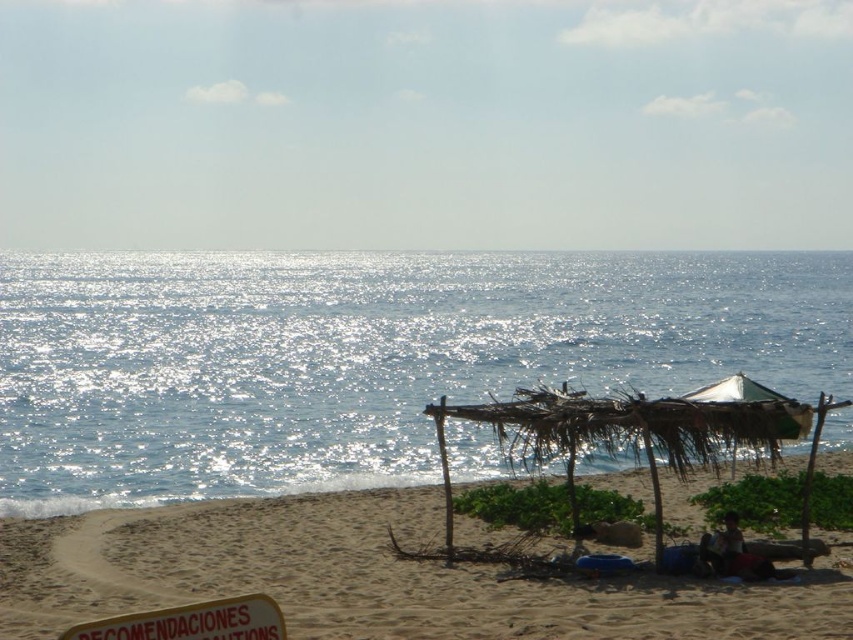
Describe the element at coordinates (361, 356) in the screenshot. I see `shiny blue water at upper center` at that location.

Where is `shiny blue water at upper center`? shiny blue water at upper center is located at coordinates (361, 356).

Based on the photo, does shiny blue water at upper center have a greater width compared to sandy beach at lower center?

Indeed, shiny blue water at upper center has a greater width compared to sandy beach at lower center.

Which is in front, point (476, 285) or point (335, 602)?

Point (335, 602) is in front.

Which is behind, point (802, 362) or point (390, 492)?

The point (802, 362) is more distant.

Identify the location of shiny blue water at upper center. (361, 356).

Who is shorter, green thatched umbrella at center or brown leather bag at lower right?

brown leather bag at lower right

At what (x,y) coordinates should I click in order to perform the action: click on green thatched umbrella at center. Please return your answer as a coordinate pair (x, y). Looking at the image, I should click on (630, 429).

At what (x,y) coordinates should I click in order to perform the action: click on green thatched umbrella at center. Please return your answer as a coordinate pair (x, y). Image resolution: width=853 pixels, height=640 pixels. Looking at the image, I should click on (630, 429).

I want to click on green thatched umbrella at center, so click(x=630, y=429).